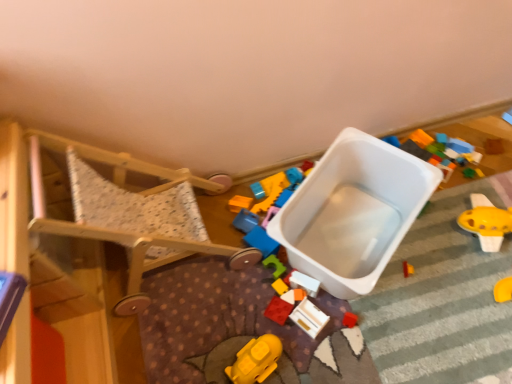
Find the location of `free space to the left of white plastic toy at center, which ranks as the fourth toy in left-to-right order`. free space to the left of white plastic toy at center, which ranks as the fourth toy in left-to-right order is located at coordinates (251, 297).